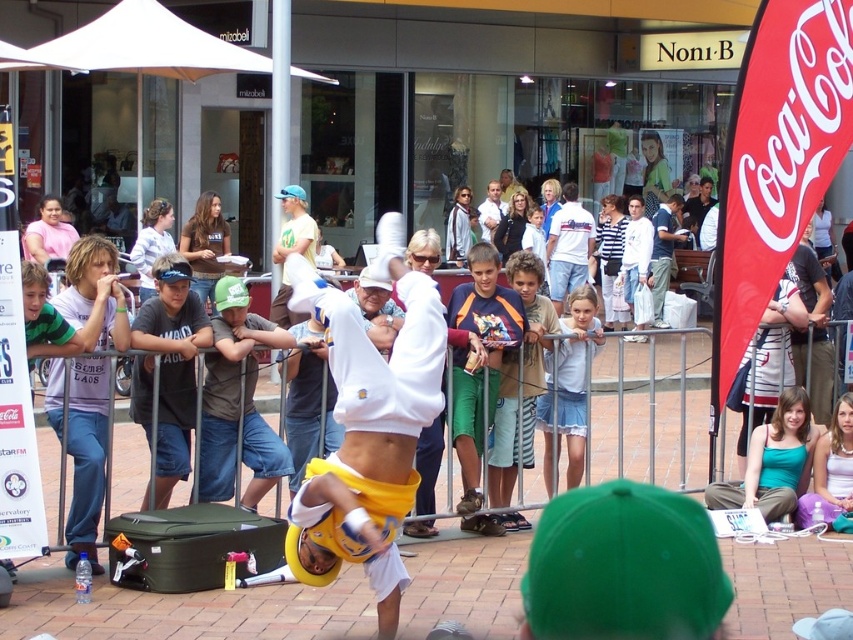
Is white matte sweatshirt at center bigger than white cotton shirt at center?

Incorrect, white matte sweatshirt at center is not larger than white cotton shirt at center.

Between white matte sweatshirt at center and white cotton shirt at center, which one is positioned lower?

white matte sweatshirt at center is lower down.

Is point (393, 374) behind point (480, 237)?

No, (393, 374) is in front of (480, 237).

I want to click on white matte sweatshirt at center, so click(x=370, y=422).